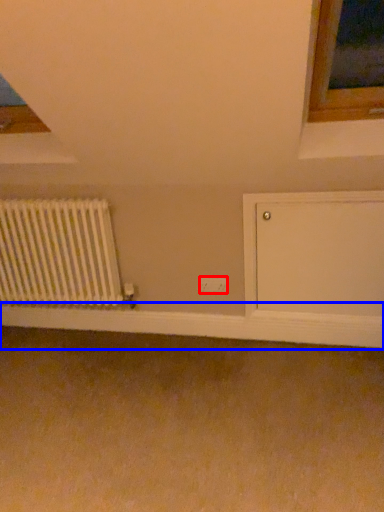
Question: Which point is closer to the camera, electric outlet (highlighted by a red box) or window sill (highlighted by a blue box)?

Choices:
 (A) electric outlet
 (B) window sill

Answer: (B)